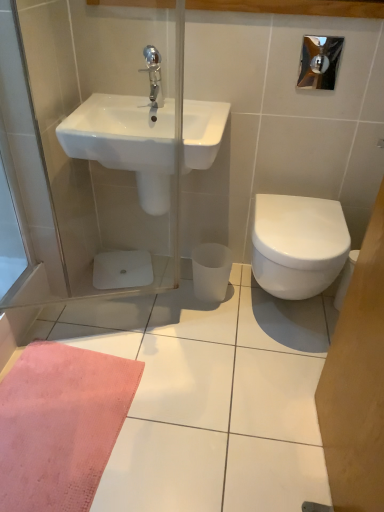
Question: From the image's perspective, relative to white glossy sink at upper left, is white glossy bidet at right above or below?

Choices:
 (A) above
 (B) below

Answer: (B)

Question: Based on their positions, is white glossy bidet at right located to the left or right of white glossy sink at upper left?

Choices:
 (A) right
 (B) left

Answer: (A)

Question: Considering the real-world distances, which object is farthest from the white glossy bidet at right?

Choices:
 (A) chrome metallic faucet at upper center
 (B) white glossy sink at upper left

Answer: (A)

Question: Which object is positioned closest to the white glossy bidet at right?

Choices:
 (A) chrome metallic faucet at upper center
 (B) white glossy sink at upper left

Answer: (B)